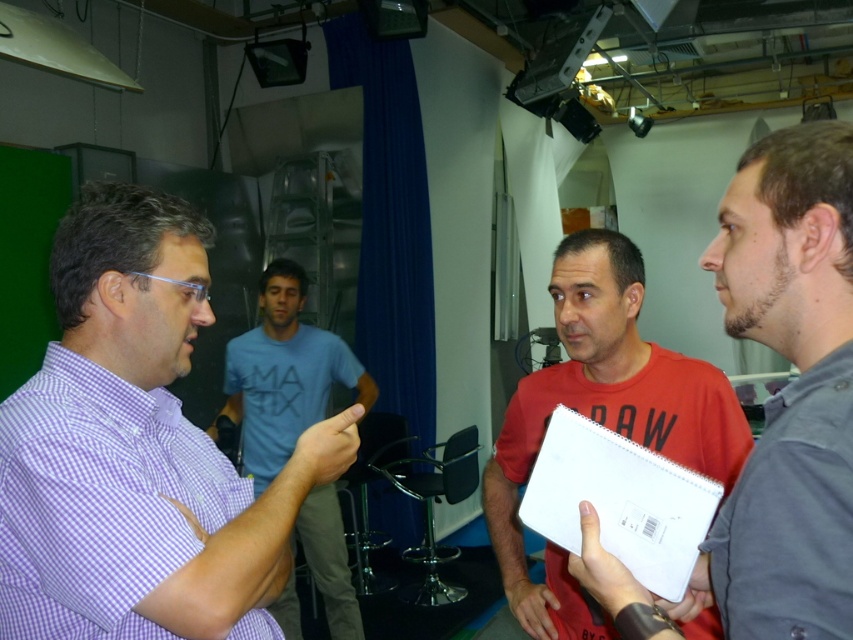
Which is more to the left, red matte shirt at center or matte blue shirt at center?

matte blue shirt at center

Who is positioned more to the right, red matte shirt at center or matte blue shirt at center?

Positioned to the right is red matte shirt at center.

I want to click on red matte shirt at center, so click(601, 417).

Can you confirm if matte gray notebook at center is smaller than matte blue shirt at center?

Yes, matte gray notebook at center is smaller than matte blue shirt at center.

Is matte gray notebook at center positioned behind matte blue shirt at center?

No, it is in front of matte blue shirt at center.

Which is in front, point (851, 464) or point (367, 406)?

Point (851, 464) is more forward.

Identify the location of matte gray notebook at center. The width and height of the screenshot is (853, 640). (773, 406).

Is the position of purple checkered shirt at left less distant than that of red matte shirt at center?

Yes, it is.

Measure the distance between point (x=138, y=244) and camera.

A distance of 1.12 meters exists between point (x=138, y=244) and camera.

Between point (125, 419) and point (537, 426), which one is positioned behind?

The point (537, 426) is more distant.

Identify the location of purple checkered shirt at left. (137, 449).